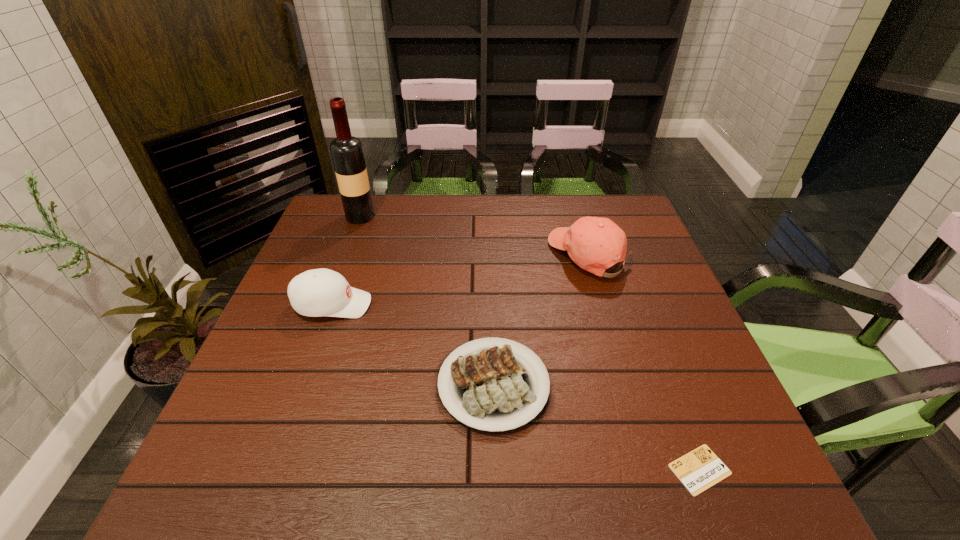
Identify the location of empty location between the tallest object and the identity card. The height and width of the screenshot is (540, 960). coord(530,343).

Point out which object is positioned as the nearest to the nearest object. Please provide its 2D coordinates. Your answer should be formatted as a tuple, i.e. [(x, y)], where the tuple contains the x and y coordinates of a point satisfying the conditions above.

[(490, 389)]

Identify the location of the closest object relative to the nearest object. Image resolution: width=960 pixels, height=540 pixels. (490, 389).

Locate an element on the screen. vacant position in the image that satisfies the following two spatial constraints: 1. on the front side of the right baseball cap; 2. on the front-facing side of the nearer baseball cap is located at coordinates (603, 305).

Find the location of a particular element. vacant point that satisfies the following two spatial constraints: 1. on the front side of the farther baseball cap; 2. on the front-facing side of the shorter baseball cap is located at coordinates (603, 305).

You are a GUI agent. You are given a task and a screenshot of the screen. Output one action in this format:
    pyautogui.click(x=<x>, y=<y>)
    Task: Click on the vacant space that satisfies the following two spatial constraints: 1. on the front-facing side of the left baseball cap; 2. on the left side of the identity card
    This screenshot has height=540, width=960.
    Given the screenshot: What is the action you would take?
    pyautogui.click(x=274, y=469)

Where is `free space that satisfies the following two spatial constraints: 1. on the front side of the tallest object; 2. on the left side of the identity card`? The width and height of the screenshot is (960, 540). free space that satisfies the following two spatial constraints: 1. on the front side of the tallest object; 2. on the left side of the identity card is located at coordinates (267, 469).